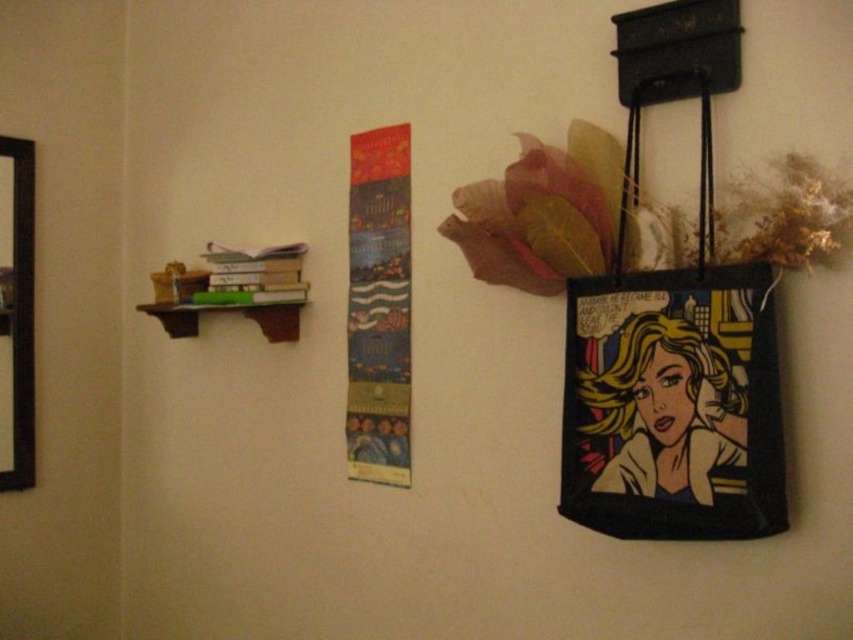
You are an interior designer planning to hang a new clock between the textured fabric banner at center and the black wooden picture frame at left. The clock has a diameter of 12 inches. Will there be enough space between them to fit the clock without overlapping either item?

The distance between the textured fabric banner at center and the black wooden picture frame at left is 34.86 inches. Since the clock has a diameter of 12 inches, there is sufficient space to place it between them without overlapping either item.

You are an interior designer assessing the wall layout. You need to determine if the textured fabric banner at center can be hung above the black wooden picture frame at left without overlapping. Based on their sizes, what do you conclude?

The textured fabric banner at center is not as tall as the black wooden picture frame at left, so it can be hung above the frame without overlapping since it is shorter in height.